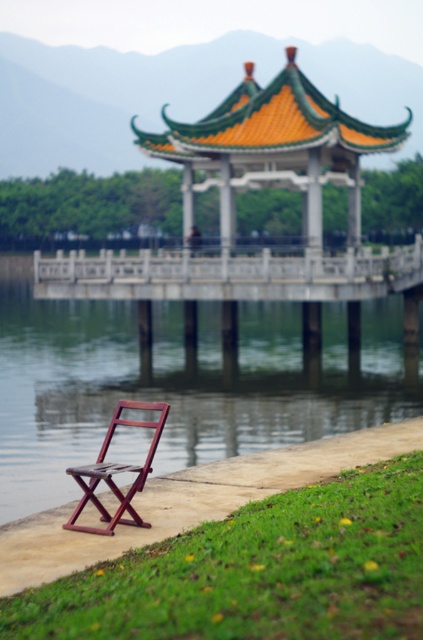
Between point (329, 108) and point (90, 465), which one is positioned behind?

The point (329, 108) is more distant.

Does point (241, 106) come in front of point (82, 472)?

No, (241, 106) is behind (82, 472).

Identify the location of green glazed tiles at center. The width and height of the screenshot is (423, 640). (274, 148).

Can you confirm if transparent water at chair left is thinner than mahogany wood folding chair at lower left?

No.

Is transparent water at chair left wider than mahogany wood folding chair at lower left?

Yes.

Is point (362, 308) positioned after point (98, 502)?

Yes, point (362, 308) is farther from viewer.

Locate an element on the screen. transparent water at chair left is located at coordinates (180, 381).

Does transparent water at chair left have a lesser width compared to green glazed tiles at center?

In fact, transparent water at chair left might be wider than green glazed tiles at center.

Between point (22, 296) and point (252, 65), which one is positioned in front?

Point (252, 65)

Describe the element at coordinates (180, 381) in the screenshot. I see `transparent water at chair left` at that location.

At what (x,y) coordinates should I click in order to perform the action: click on transparent water at chair left. Please return your answer as a coordinate pair (x, y). This screenshot has height=640, width=423. Looking at the image, I should click on (180, 381).